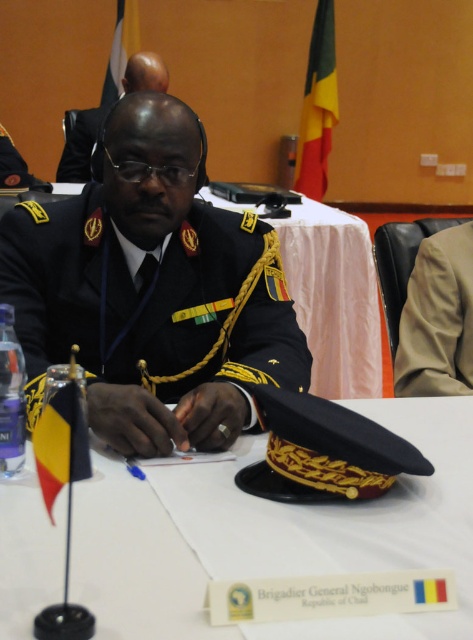
You are a military assistant tasked with organizing the items on the table. You notice two black uniforms at the center. Which one is closer to you, the black matte uniform at center or the black uniform at center?

The black matte uniform at center is closer to you since it is in front of the black uniform at center.

You are a military assistant tasked with organizing documents on the table. You have a white paper at center and a black matte uniform at center. Which item should you place in the document holder first based on their size?

The white paper at center is shorter than the black matte uniform at center, so you should place the white paper at center first since it is smaller and fits better in the document holder.